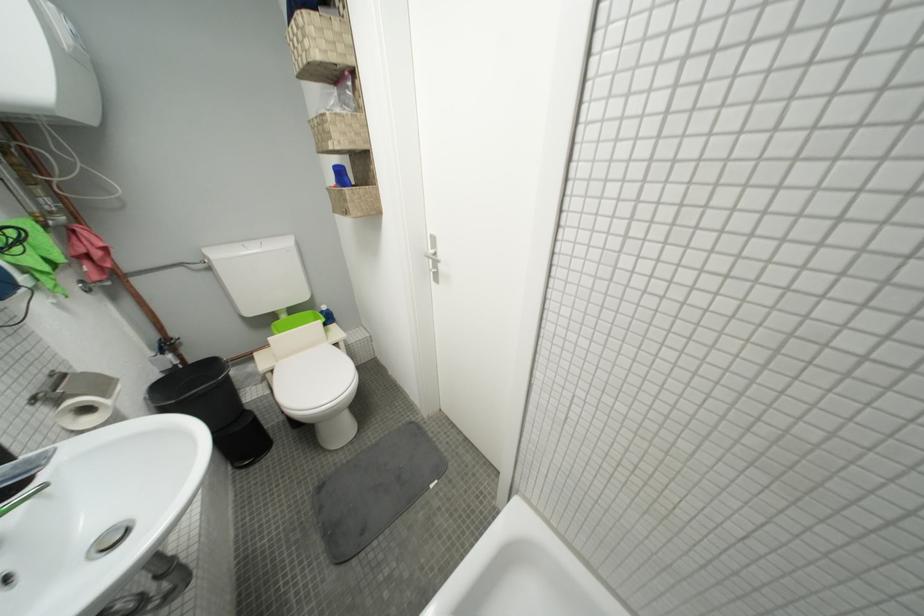
Find where to lift the blue plastic cup. Please return your answer as a coordinate pair (x, y).

(341, 176)